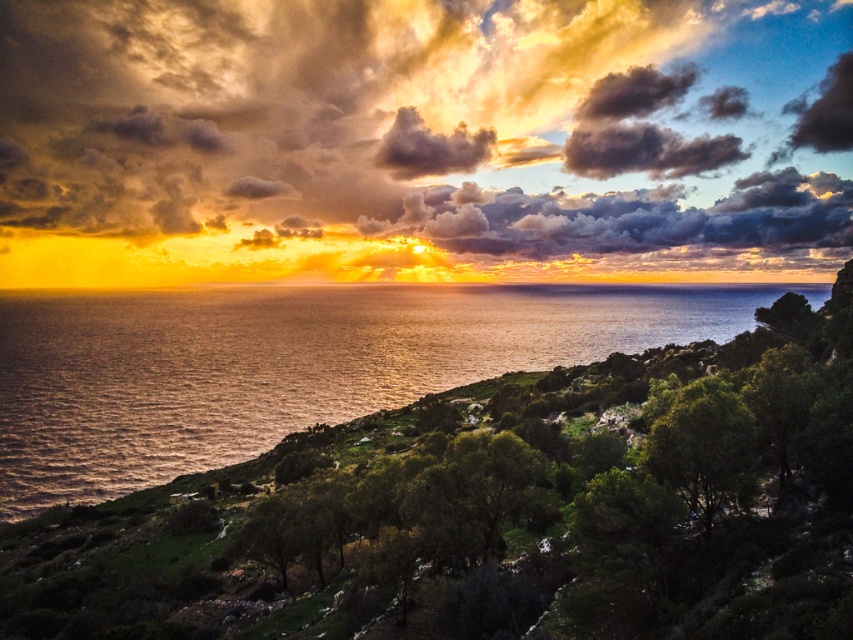
Can you confirm if golden textured clouds at upper center is positioned to the right of shiny metallic water at center?

In fact, golden textured clouds at upper center is to the left of shiny metallic water at center.

How far apart are golden textured clouds at upper center and shiny metallic water at center?

They are 245.13 meters apart.

Measure the distance between point (747, 90) and camera.

Point (747, 90) is 757.39 meters away from camera.

Locate an element on the screen. The height and width of the screenshot is (640, 853). golden textured clouds at upper center is located at coordinates (431, 131).

Which of these two, golden textured clouds at upper center or green leafy tree at lower right, stands taller?

golden textured clouds at upper center is taller.

Does golden textured clouds at upper center appear on the right side of green leafy tree at lower right?

In fact, golden textured clouds at upper center is to the left of green leafy tree at lower right.

Is point (427, 1) more distant than point (693, 448)?

Yes.

Where is `golden textured clouds at upper center`? This screenshot has height=640, width=853. golden textured clouds at upper center is located at coordinates (431, 131).

Can you confirm if green leafy tree at lower right is bigger than smokey gray cloud at upper center?

Actually, green leafy tree at lower right might be smaller than smokey gray cloud at upper center.

Based on the photo, who is higher up, green leafy tree at lower right or smokey gray cloud at upper center?

smokey gray cloud at upper center is above.

Is point (683, 413) positioned after point (404, 125)?

No.

You are a GUI agent. You are given a task and a screenshot of the screen. Output one action in this format:
    pyautogui.click(x=<x>, y=<y>)
    Task: Click on the green leafy tree at lower right
    This screenshot has height=640, width=853.
    Given the screenshot: What is the action you would take?
    pyautogui.click(x=700, y=444)